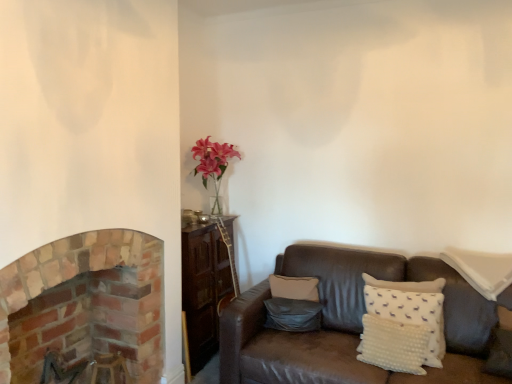
Question: Does white dotted pillow at lower right, which is the second pillow in right-to-left order, have a larger size compared to white dotted pillow at right, the third pillow positioned from the left?

Choices:
 (A) yes
 (B) no

Answer: (B)

Question: Is white dotted pillow at right, the third pillow positioned from the left, inside white dotted pillow at lower right, which is the second pillow in left-to-right order?

Choices:
 (A) no
 (B) yes

Answer: (A)

Question: From a real-world perspective, is white dotted pillow at lower right, which is the second pillow in right-to-left order, positioned under white dotted pillow at right, which is the first pillow in right-to-left order, based on gravity?

Choices:
 (A) no
 (B) yes

Answer: (B)

Question: From the image's perspective, is white dotted pillow at lower right, which is the second pillow in right-to-left order, on top of white dotted pillow at right, which is the first pillow in right-to-left order?

Choices:
 (A) no
 (B) yes

Answer: (A)

Question: Does white dotted pillow at lower right, which is the second pillow in right-to-left order, have a greater width compared to white dotted pillow at right, which is the first pillow in right-to-left order?

Choices:
 (A) yes
 (B) no

Answer: (B)

Question: Is white dotted pillow at lower right, which is the second pillow in left-to-right order, positioned with its back to white dotted pillow at right, which is the first pillow in right-to-left order?

Choices:
 (A) yes
 (B) no

Answer: (A)

Question: Could you tell me if brick fireplace at left is turned towards matte gray pillow at center, which is the 3th pillow from right to left?

Choices:
 (A) yes
 (B) no

Answer: (B)

Question: Does brick fireplace at left come in front of matte gray pillow at center, which ranks as the first pillow in left-to-right order?

Choices:
 (A) no
 (B) yes

Answer: (B)

Question: Are brick fireplace at left and matte gray pillow at center, which ranks as the first pillow in left-to-right order, far apart?

Choices:
 (A) yes
 (B) no

Answer: (A)

Question: Can you confirm if brick fireplace at left is wider than matte gray pillow at center, which ranks as the first pillow in left-to-right order?

Choices:
 (A) no
 (B) yes

Answer: (B)

Question: Is matte gray pillow at center, which is the 3th pillow from right to left, located within brick fireplace at left?

Choices:
 (A) no
 (B) yes

Answer: (A)

Question: Is brick fireplace at left next to matte gray pillow at center, which is the 3th pillow from right to left, and touching it?

Choices:
 (A) no
 (B) yes

Answer: (A)

Question: Is white dotted pillow at right, which is the first pillow in right-to-left order, bigger than brick fireplace at left?

Choices:
 (A) no
 (B) yes

Answer: (A)